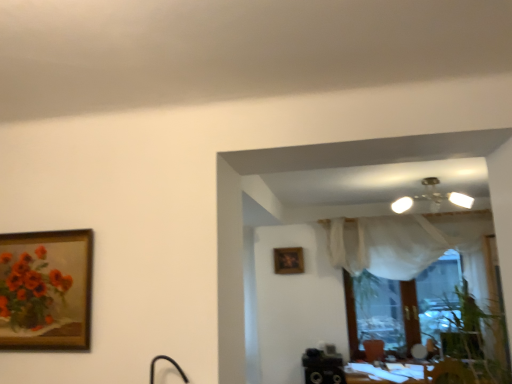
Locate an element on the screen. wooden frame at center is located at coordinates (288, 260).

The image size is (512, 384). What do you see at coordinates (31, 291) in the screenshot?
I see `matte floral painting at left` at bounding box center [31, 291].

This screenshot has height=384, width=512. What do you see at coordinates (414, 374) in the screenshot?
I see `white glossy table at lower right` at bounding box center [414, 374].

Locate an element on the screen. wooden frame at center is located at coordinates (288, 260).

How many degrees apart are the facing directions of matte floral painting at left and white glossy table at lower right?

The facing directions of matte floral painting at left and white glossy table at lower right are 1.7 degrees apart.

Considering the points (50, 277) and (348, 381), which point is behind, point (50, 277) or point (348, 381)?

The point (348, 381) is more distant.

From the image's perspective, is matte floral painting at left under white glossy table at lower right?

No, from the image's perspective, matte floral painting at left is not beneath white glossy table at lower right.

Image resolution: width=512 pixels, height=384 pixels. Find the location of `table that is on the right side of matte floral painting at left`. table that is on the right side of matte floral painting at left is located at coordinates (414, 374).

Between white glossy table at lower right and matte floral painting at left, which one has more height?

Standing taller between the two is matte floral painting at left.

Consider the image. Relative to matte floral painting at left, is white glossy table at lower right in front or behind?

In the image, white glossy table at lower right appears behind matte floral painting at left.

From the image's perspective, is white glossy table at lower right on top of matte floral painting at left?

Actually, white glossy table at lower right appears below matte floral painting at left in the image.

Is white glossy table at lower right turned away from wooden frame at center?

No, white glossy table at lower right's orientation is not away from wooden frame at center.

Is point (452, 376) positioned behind point (296, 255)?

No.

From the image's perspective, is white glossy table at lower right located above wooden frame at center?

No, from the image's perspective, white glossy table at lower right is not on top of wooden frame at center.

Can wooden frame at center be found inside matte floral painting at left?

No.

From a real-world perspective, between matte floral painting at left and wooden frame at center, who is vertically lower?

From a 3D spatial view, matte floral painting at left is below.

In the scene shown: Would you consider matte floral painting at left to be distant from wooden frame at center?

matte floral painting at left is positioned a significant distance from wooden frame at center.

Considering the positions of point (38, 292) and point (288, 257), is point (38, 292) closer or farther from the camera than point (288, 257)?

Point (38, 292) appears to be closer to the viewer than point (288, 257).

Measure the distance from wooden frame at center to matte floral painting at left.

They are 3.01 meters apart.

Considering the relative sizes of wooden frame at center and matte floral painting at left in the image provided, is wooden frame at center taller than matte floral painting at left?

In fact, wooden frame at center may be shorter than matte floral painting at left.

Could matte floral painting at left be considered to be inside wooden frame at center?

No, matte floral painting at left is not a part of wooden frame at center.

Is wooden frame at center touching matte floral painting at left?

wooden frame at center is not next to matte floral painting at left, and they're not touching.

Is wooden frame at center far from white glossy table at lower right?

Yes, wooden frame at center and white glossy table at lower right are located far from each other.

Which object is further away from the camera, wooden frame at center or white glossy table at lower right?

wooden frame at center is further from the camera.

Between wooden frame at center and white glossy table at lower right, which one has larger width?

white glossy table at lower right is wider.

How distant is wooden frame at center from white glossy table at lower right?

wooden frame at center is 1.33 meters from white glossy table at lower right.

Identify the location of table on the right of matte floral painting at left. (414, 374).

Locate an element on the screen. The image size is (512, 384). flower that appears above the white glossy table at lower right (from the image's perspective) is located at coordinates (31, 291).

Based on their spatial positions, is wooden frame at center or matte floral painting at left further from white glossy table at lower right?

matte floral painting at left is positioned further to the anchor white glossy table at lower right.

Considering their positions, is white glossy table at lower right positioned further to matte floral painting at left than wooden frame at center?

Based on the image, white glossy table at lower right appears to be further to matte floral painting at left.

Considering their positions, is wooden frame at center positioned further to matte floral painting at left than white glossy table at lower right?

white glossy table at lower right lies further to matte floral painting at left than the other object.

When comparing their distances from white glossy table at lower right, does matte floral painting at left or wooden frame at center seem further?

Among the two, matte floral painting at left is located further to white glossy table at lower right.

Considering their positions, is matte floral painting at left positioned closer to wooden frame at center than white glossy table at lower right?

white glossy table at lower right lies closer to wooden frame at center than the other object.

Estimate the real-world distances between objects in this image. Which object is further from wooden frame at center, white glossy table at lower right or matte floral painting at left?

The object further to wooden frame at center is matte floral painting at left.

Image resolution: width=512 pixels, height=384 pixels. I want to click on table between matte floral painting at left and wooden frame at center in the front-back direction, so click(x=414, y=374).